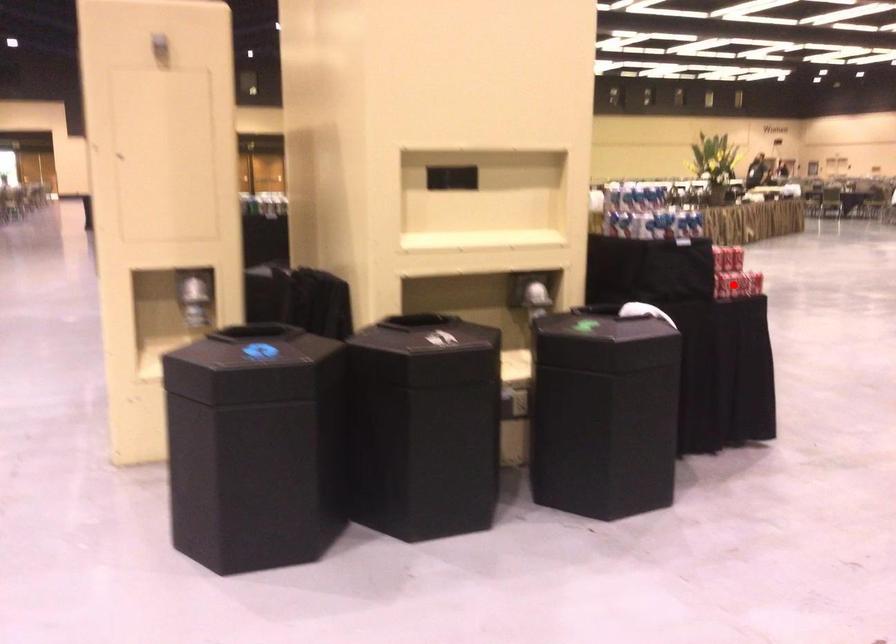
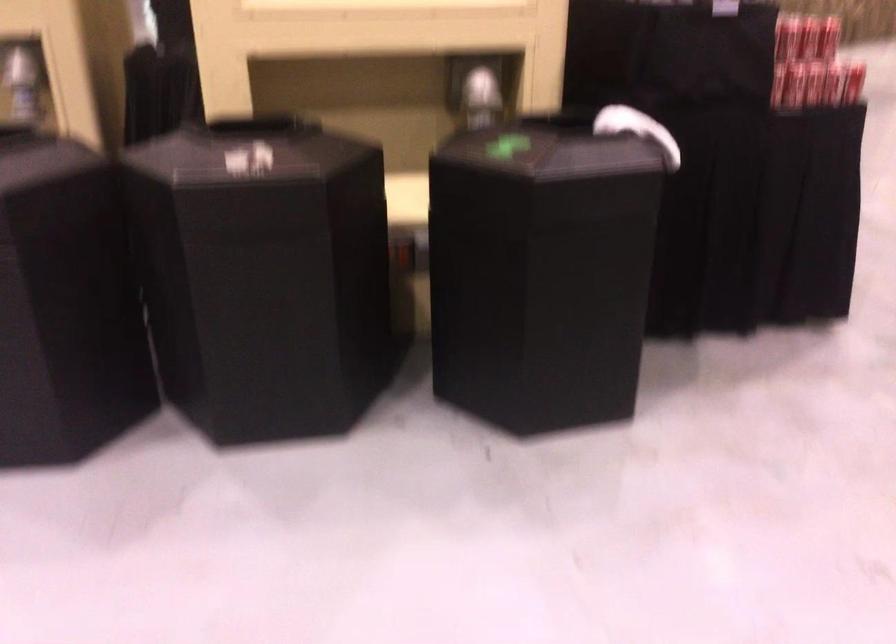
The point at the highlighted location is marked in the first image. Where is the corresponding point in the second image?

(788, 84)